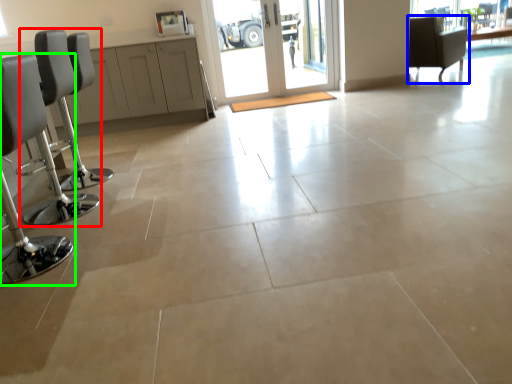
Question: Which object is positioned farthest from chair (highlighted by a red box)? Select from chair (highlighted by a blue box) and chair (highlighted by a green box).

Choices:
 (A) chair
 (B) chair

Answer: (A)